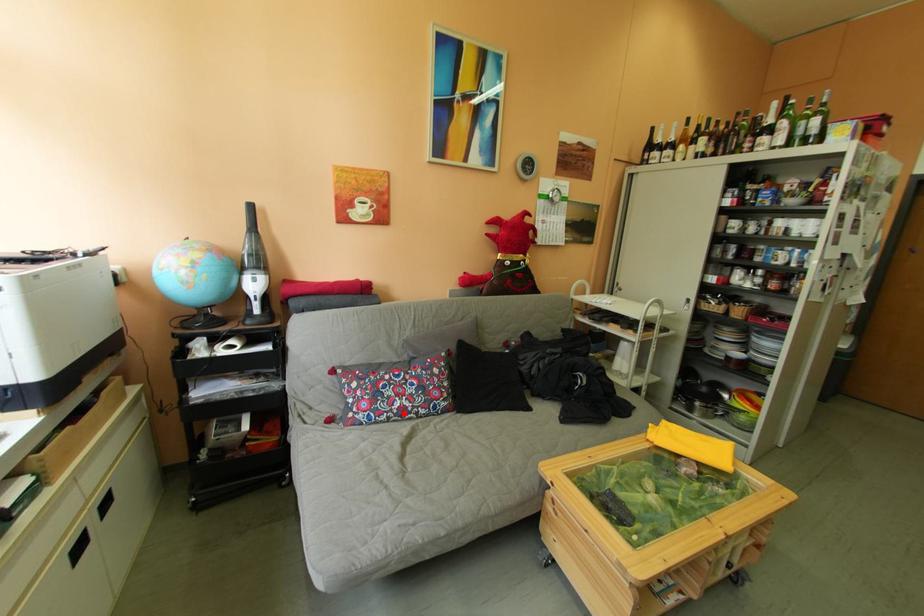
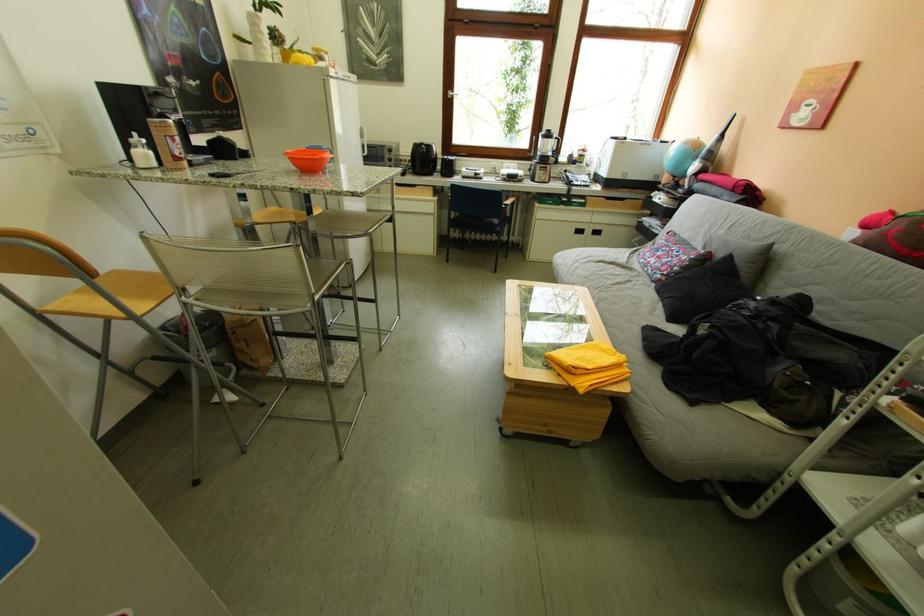
Question: I am providing you with two images of the same scene from different viewpoints. A red point is shown in image1. For the corresponding object point in image2, is it positioned nearer or farther from the camera?

Choices:
 (A) Nearer
 (B) Farther

Answer: (A)